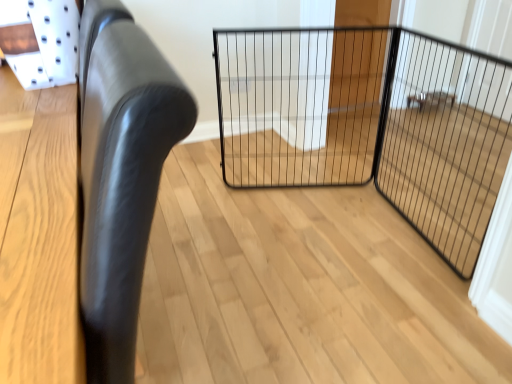
Image resolution: width=512 pixels, height=384 pixels. I want to click on space that is in front of black wire mesh screen door at center, so click(x=417, y=294).